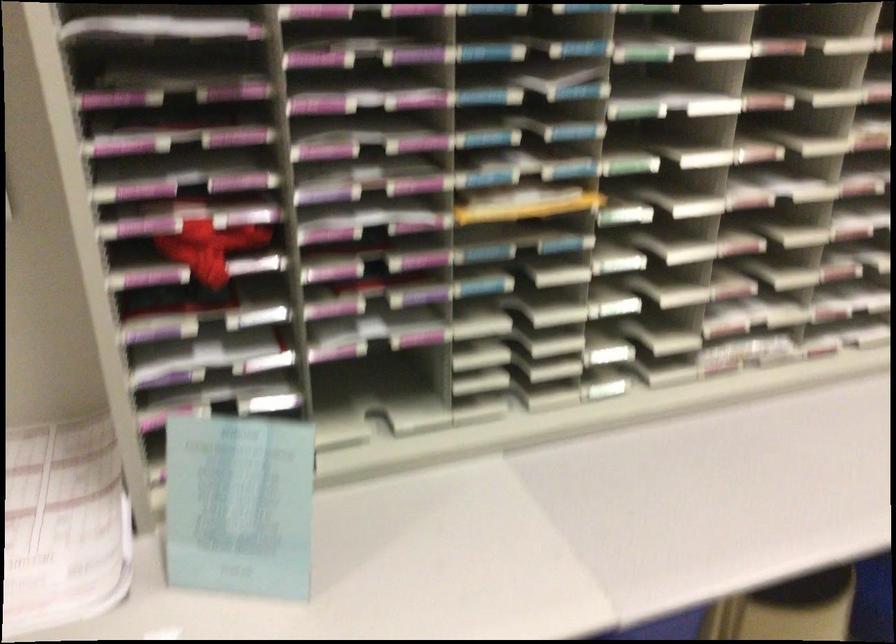
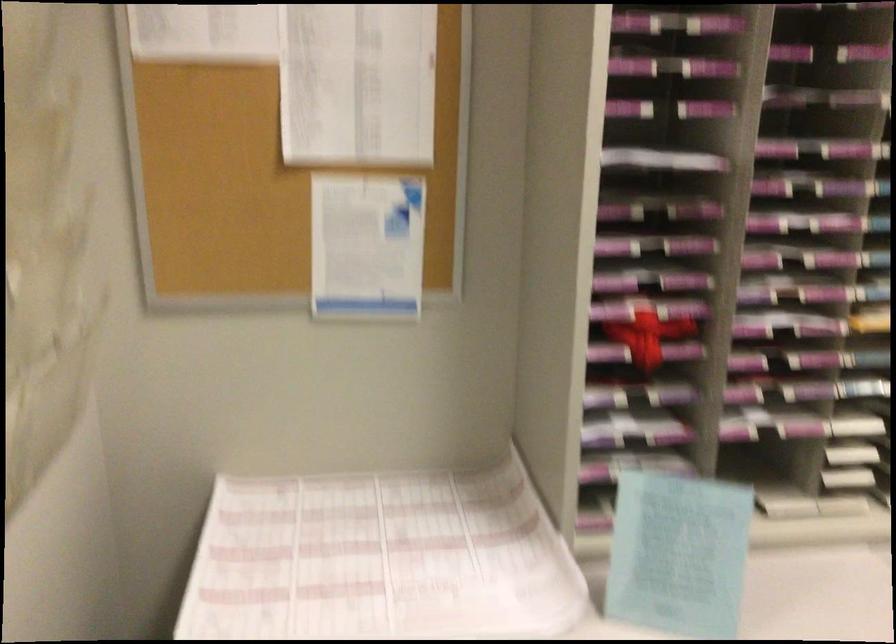
What movement of the cameraman would produce the second image?

The movement direction of the cameraman is left, backward.